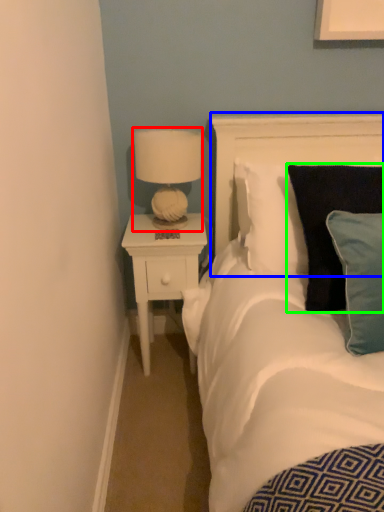
Question: Which object is the farthest from lamp (highlighted by a red box)? Choose among these: headboard (highlighted by a blue box) or pillow (highlighted by a green box).

Choices:
 (A) headboard
 (B) pillow

Answer: (B)